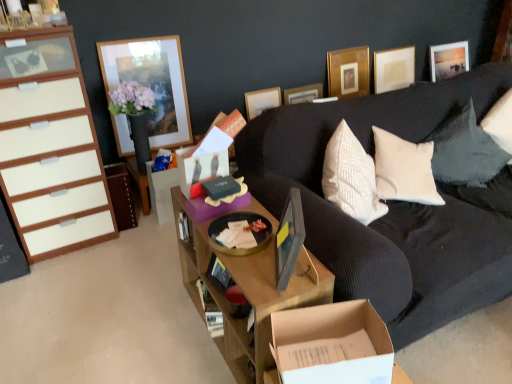
You are a GUI agent. You are given a task and a screenshot of the screen. Output one action in this format:
    pyautogui.click(x=<x>, y=<y>)
    Task: Click on the empty space that is ontop of wooden desk at center
    This screenshot has height=384, width=512.
    Given the screenshot: What is the action you would take?
    pyautogui.click(x=254, y=246)